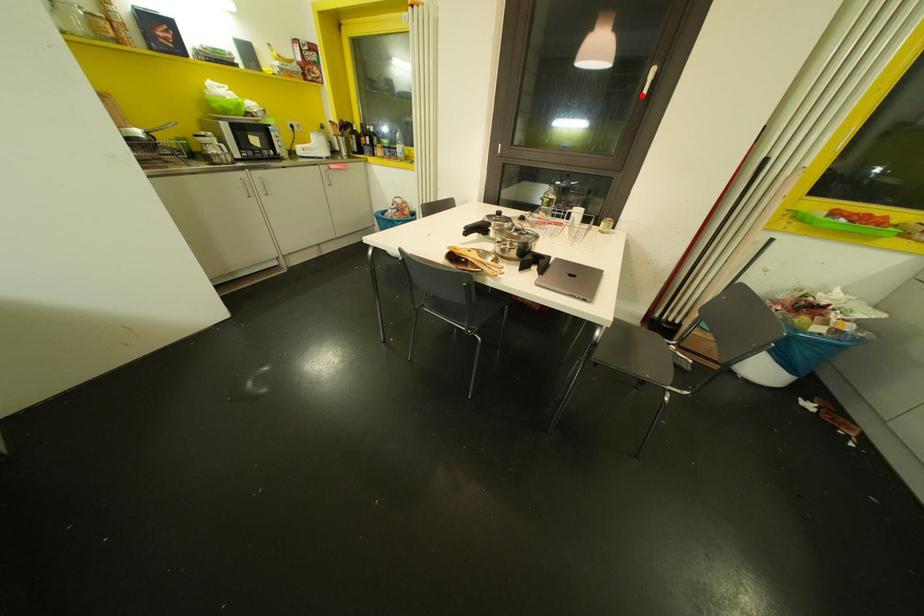
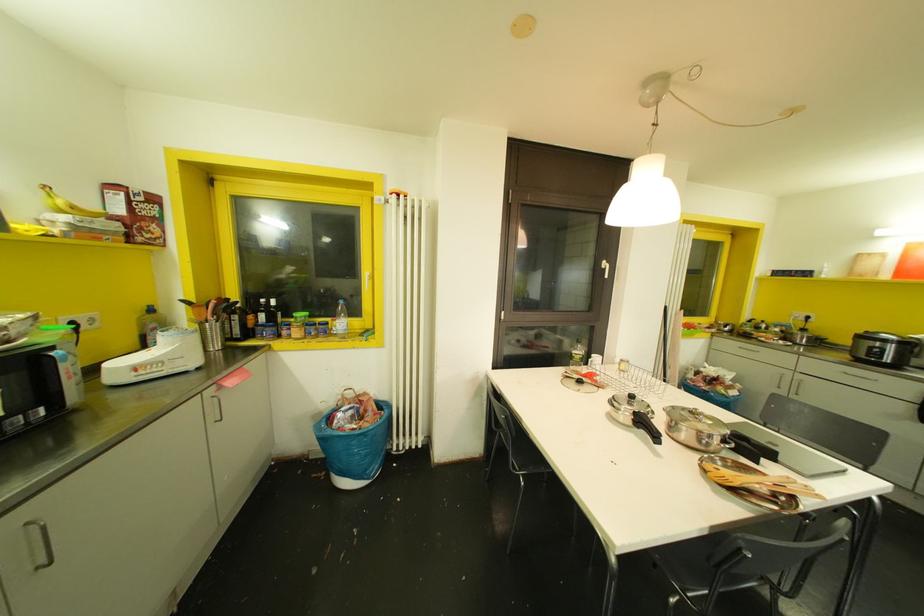
Locate, in the second image, the point that corresponds to the highlighted location in the first image.

(605, 276)